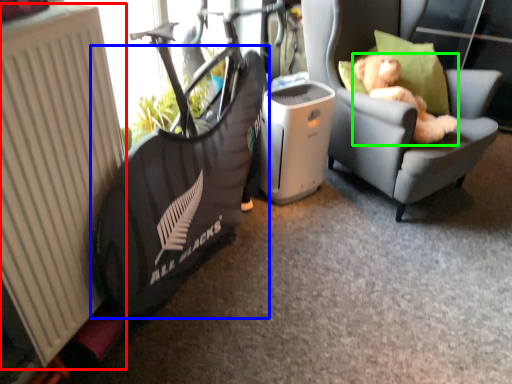
Question: Considering the real-world distances, which object is closest to radiator (highlighted by a red box)? bean bag chair (highlighted by a blue box) or animal (highlighted by a green box).

Choices:
 (A) bean bag chair
 (B) animal

Answer: (A)